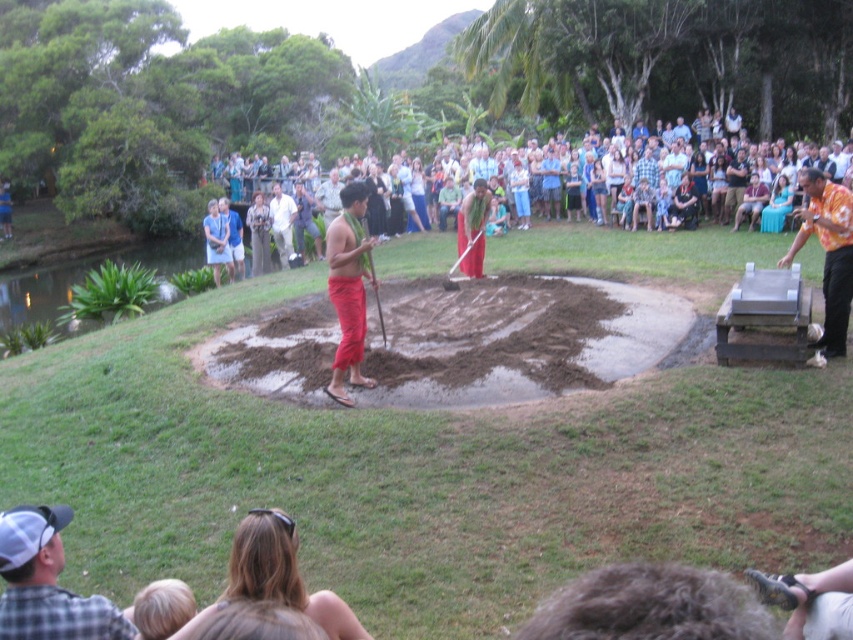
Question: Does orange printed shirt at right have a larger size compared to denim jacket at upper center?

Choices:
 (A) yes
 (B) no

Answer: (B)

Question: Which of the following is the farthest from the observer?

Choices:
 (A) (218, 266)
 (B) (231, 240)
 (C) (677, 195)
 (D) (741, 218)

Answer: (C)

Question: In this image, where is brown clay at center located relative to blue fabric shirt at upper center?

Choices:
 (A) below
 (B) above

Answer: (A)

Question: Which point is farther from the camera taking this photo?

Choices:
 (A) (685, 196)
 (B) (793, 252)
 (C) (599, 218)

Answer: (C)

Question: Does matte red loincloth at center lie in front of blue fabric shirt at upper center?

Choices:
 (A) no
 (B) yes

Answer: (B)

Question: Which point is farther to the camera?

Choices:
 (A) (520, 172)
 (B) (599, 182)
 (C) (247, 221)
 (D) (215, 256)

Answer: (A)